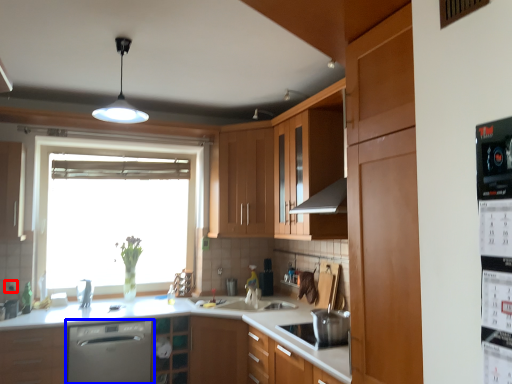
Question: Among these objects, which one is nearest to the camera, electric outlet (highlighted by a red box) or home appliance (highlighted by a blue box)?

Choices:
 (A) electric outlet
 (B) home appliance

Answer: (B)